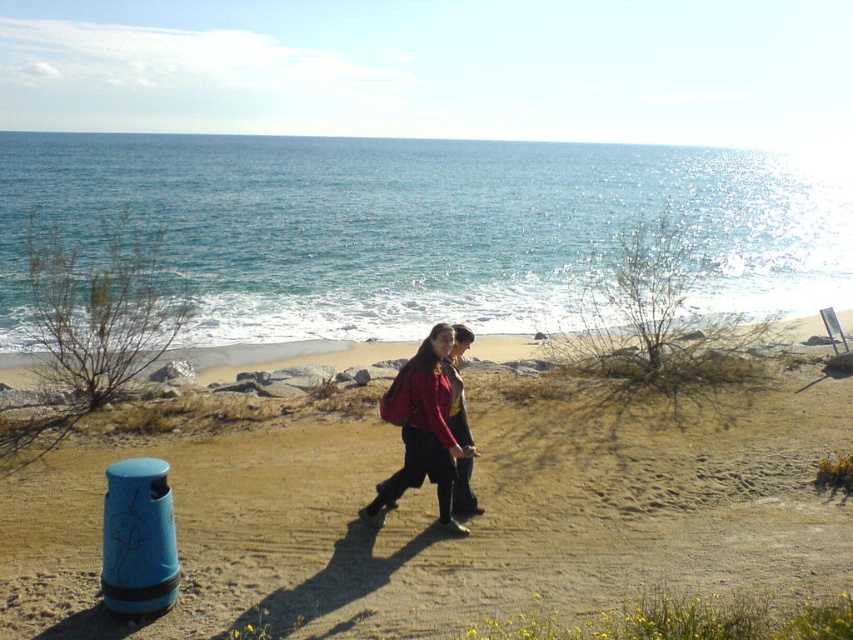
Question: Which of the following is the closest to the observer?

Choices:
 (A) (404, 460)
 (B) (161, 442)
 (C) (749, 260)

Answer: (A)

Question: Is brown sandy beach at center thinner than matte red jacket at center?

Choices:
 (A) no
 (B) yes

Answer: (A)

Question: Does blue water at upper center appear on the left side of matte red jacket at center?

Choices:
 (A) no
 (B) yes

Answer: (B)

Question: Which of the following is the closest to the observer?

Choices:
 (A) matte red jacket at center
 (B) blue water at upper center
 (C) brown sandy beach at center

Answer: (C)

Question: Can you confirm if brown sandy beach at center is thinner than blue water at upper center?

Choices:
 (A) no
 (B) yes

Answer: (B)

Question: Which of the following is the farthest from the observer?

Choices:
 (A) (419, 451)
 (B) (235, 509)
 (C) (305, 198)

Answer: (C)